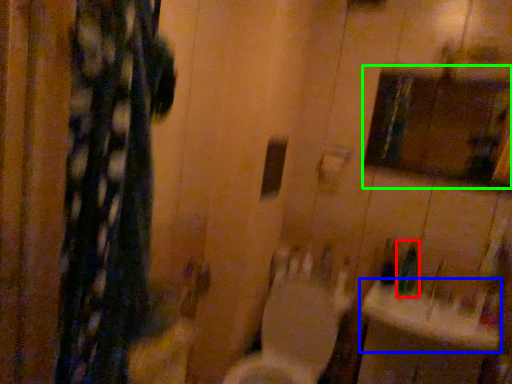
Question: Estimate the real-world distances between objects in this image. Which object is closer to toiletry (highlighted by a red box), sink (highlighted by a blue box) or medicine cabinet (highlighted by a green box)?

Choices:
 (A) sink
 (B) medicine cabinet

Answer: (A)